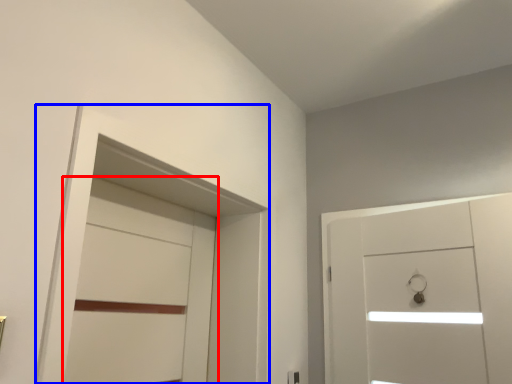
Question: Which point is closer to the camera, door (highlighted by a red box) or locker (highlighted by a blue box)?

Choices:
 (A) door
 (B) locker

Answer: (B)